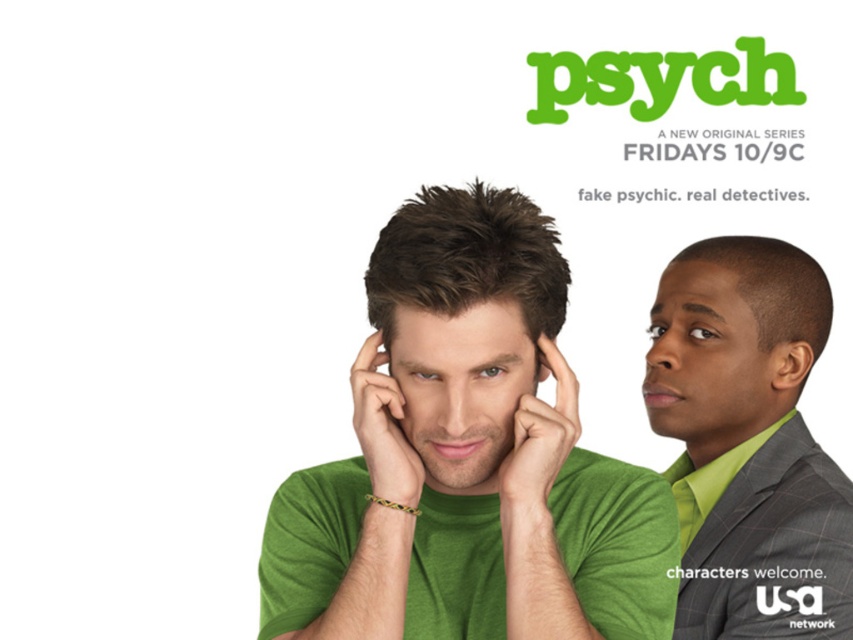
I want to click on green textured suit at right, so tap(747, 442).

Which is in front, point (721, 378) or point (389, 400)?

Point (389, 400) is more forward.

Measure the distance between green textured suit at right and camera.

They are 4.15 feet apart.

This screenshot has width=853, height=640. In order to click on green textured suit at right in this screenshot , I will do `click(747, 442)`.

Which is behind, point (670, 384) or point (541, 426)?

Point (670, 384)

Who is more forward, (781, 522) or (572, 417)?

Point (572, 417) is more forward.

The width and height of the screenshot is (853, 640). I want to click on green textured suit at right, so click(x=747, y=442).

Is green textured suit at right positioned before matte green jaw at center?

No, green textured suit at right is further to the viewer.

Does green textured suit at right have a lesser width compared to matte green jaw at center?

No.

Who is more forward, (799, 348) or (467, 458)?

Point (467, 458) is more forward.

You are a GUI agent. You are given a task and a screenshot of the screen. Output one action in this format:
    pyautogui.click(x=<x>, y=<y>)
    Task: Click on the green textured suit at right
    
    Given the screenshot: What is the action you would take?
    pyautogui.click(x=747, y=442)